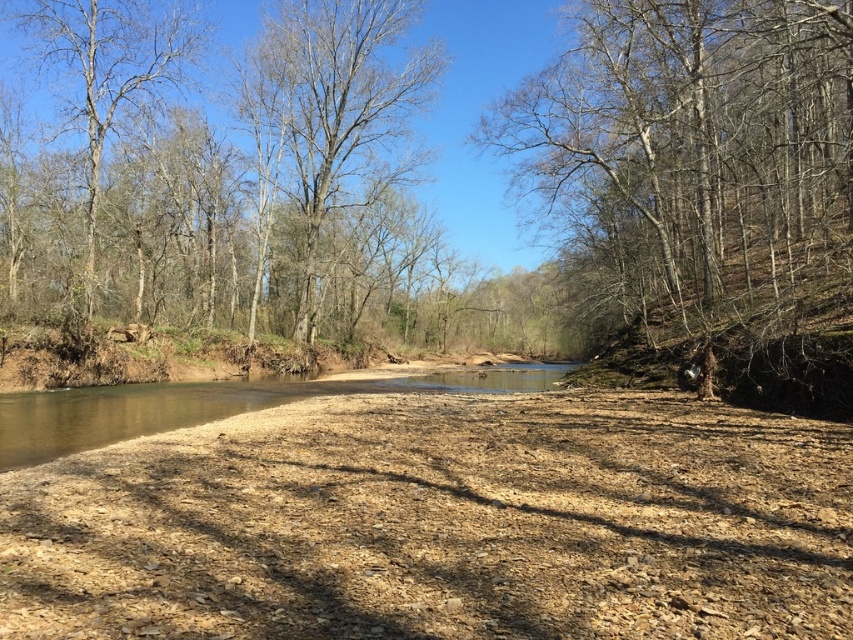
You are a hiker who wants to cross the river using a narrow path that runs between the bare branches at upper right and the bare wood tree at center. The path is exactly 15 meters long. Can you safely cross the path without getting too close to either tree?

The distance between the bare branches at upper right and the bare wood tree at center is 15.36 meters, which is slightly longer than the 15 meter path. Therefore, the path is just long enough to cross safely without getting too close to either tree.

You are standing in the middle of the wooded area and want to walk towards the river. Which object, the bare wood tree at center or the bare branches at left, would you encounter first?

The bare branches at left are smaller in size than the bare wood tree at center, so you would encounter the bare branches at left first since it is closer to your current position.